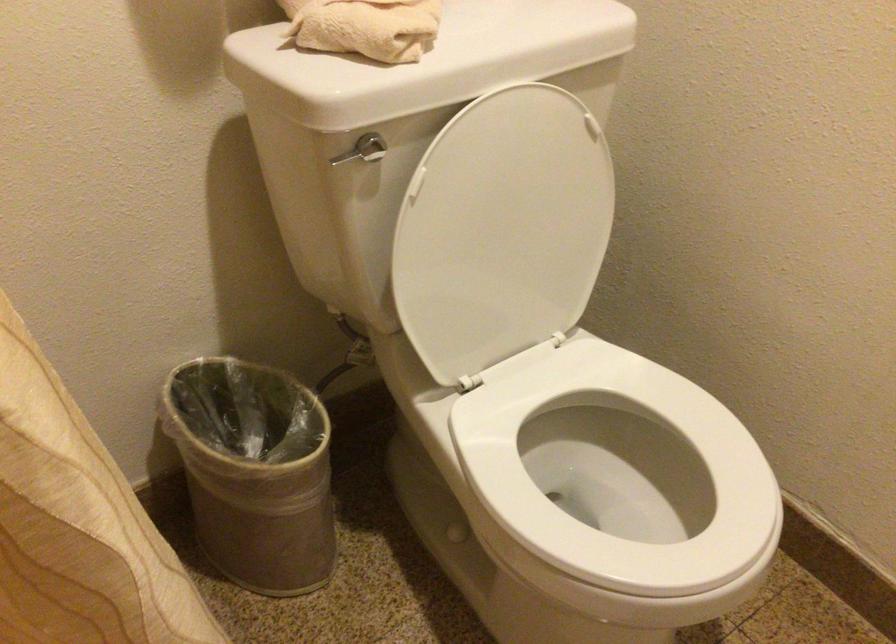
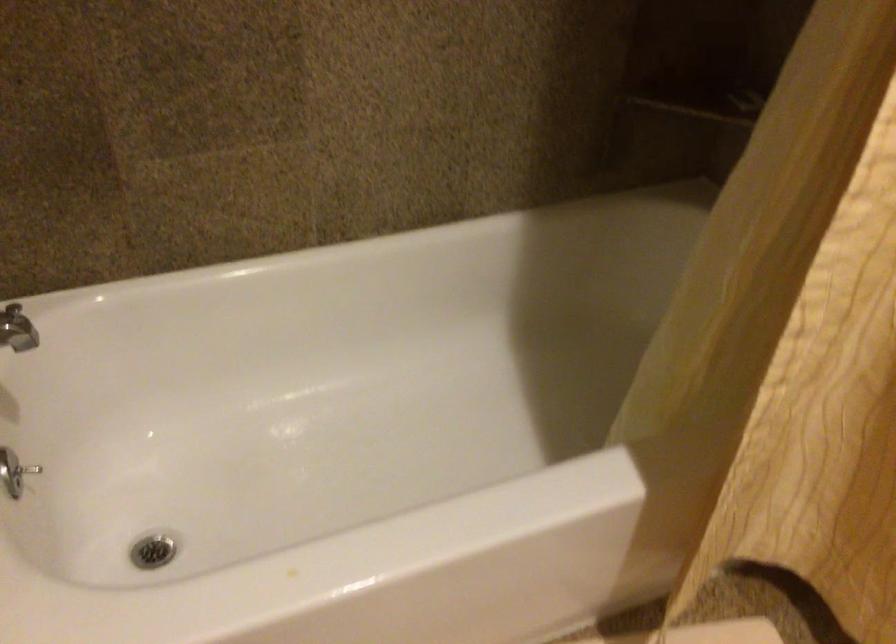
How did the camera likely rotate?

The camera rotated toward left-down.